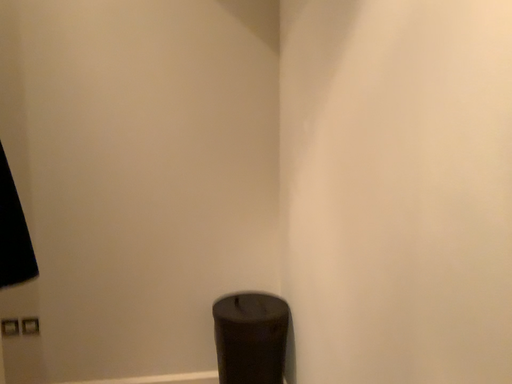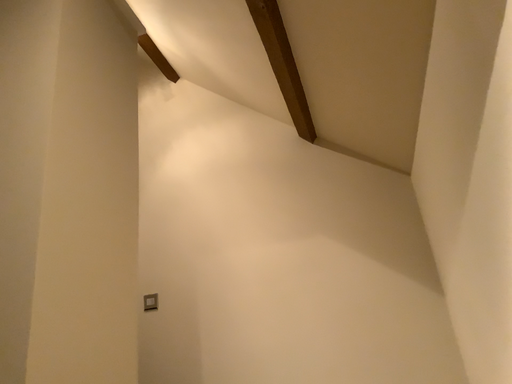
Question: Which way did the camera rotate in the video?

Choices:
 (A) rotated downward
 (B) rotated upward

Answer: (B)